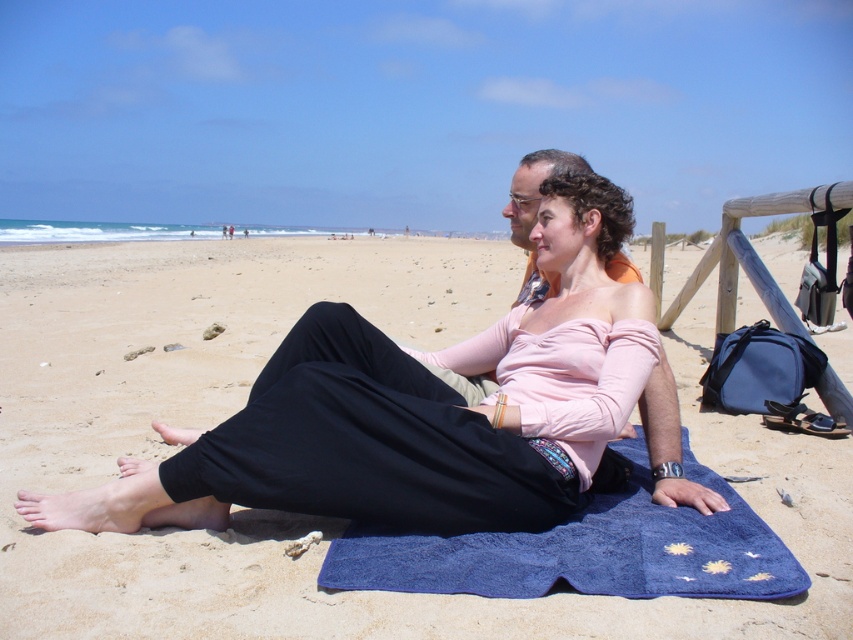
Question: Is matte black pants at center further to the viewer compared to blue fabric towel at lower center?

Choices:
 (A) yes
 (B) no

Answer: (A)

Question: Which object is farther from the camera taking this photo?

Choices:
 (A) blue fabric towel at lower center
 (B) matte black pants at center

Answer: (B)

Question: Which point is farther to the camera?

Choices:
 (A) (599, 179)
 (B) (677, 573)

Answer: (A)

Question: In this image, where is matte black pants at center located relative to blue fabric towel at lower center?

Choices:
 (A) below
 (B) above

Answer: (B)

Question: In this image, where is matte black pants at center located relative to blue fabric towel at lower center?

Choices:
 (A) above
 (B) below

Answer: (A)